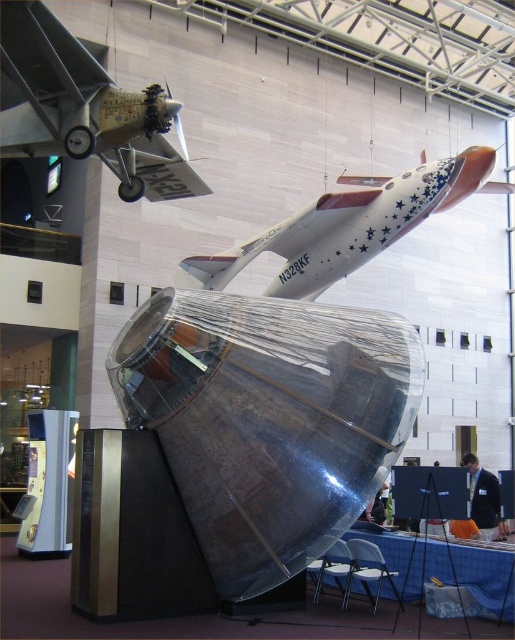
Question: In this image, where is shiny metallic spacecraft at center located relative to brushed metal airplane at upper left?

Choices:
 (A) below
 (B) above

Answer: (A)

Question: Considering the real-world distances, which object is farthest from the brushed metal airplane at upper left?

Choices:
 (A) shiny metallic spacecraft at center
 (B) white glossy airplane at upper center

Answer: (A)

Question: Which point is farther from the camera taking this photo?

Choices:
 (A) (355, 321)
 (B) (154, 88)

Answer: (B)

Question: Which of the following is the closest to the observer?

Choices:
 (A) (351, 410)
 (B) (350, 273)
 (C) (93, 58)

Answer: (A)

Question: Does brushed metal airplane at upper left have a greater width compared to white glossy airplane at upper center?

Choices:
 (A) no
 (B) yes

Answer: (A)

Question: Does shiny metallic spacecraft at center have a lesser width compared to white glossy airplane at upper center?

Choices:
 (A) no
 (B) yes

Answer: (B)